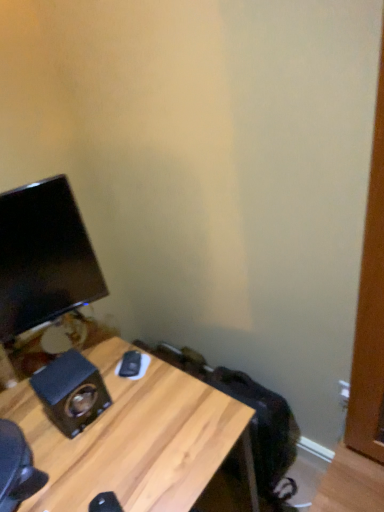
Question: Is wooden desk at lower left inside or outside of black glossy monitor at left?

Choices:
 (A) inside
 (B) outside

Answer: (B)

Question: Considering the positions of point (x=213, y=450) and point (x=43, y=278), is point (x=213, y=450) closer or farther from the camera than point (x=43, y=278)?

Choices:
 (A) closer
 (B) farther

Answer: (A)

Question: Which object is positioned farthest from the wooden grain speaker at lower left?

Choices:
 (A) black glossy monitor at left
 (B) wooden desk at lower left

Answer: (A)

Question: Based on their relative distances, which object is farther from the wooden grain speaker at lower left?

Choices:
 (A) black glossy monitor at left
 (B) wooden desk at lower left

Answer: (A)